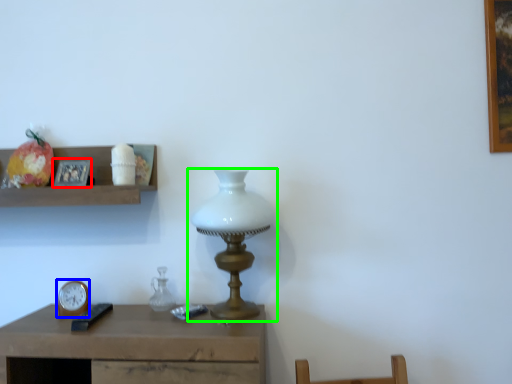
Question: Based on their relative distances, which object is farther from picture frame (highlighted by a red box)? Choose from clock (highlighted by a blue box) and lamp (highlighted by a green box).

Choices:
 (A) clock
 (B) lamp

Answer: (B)